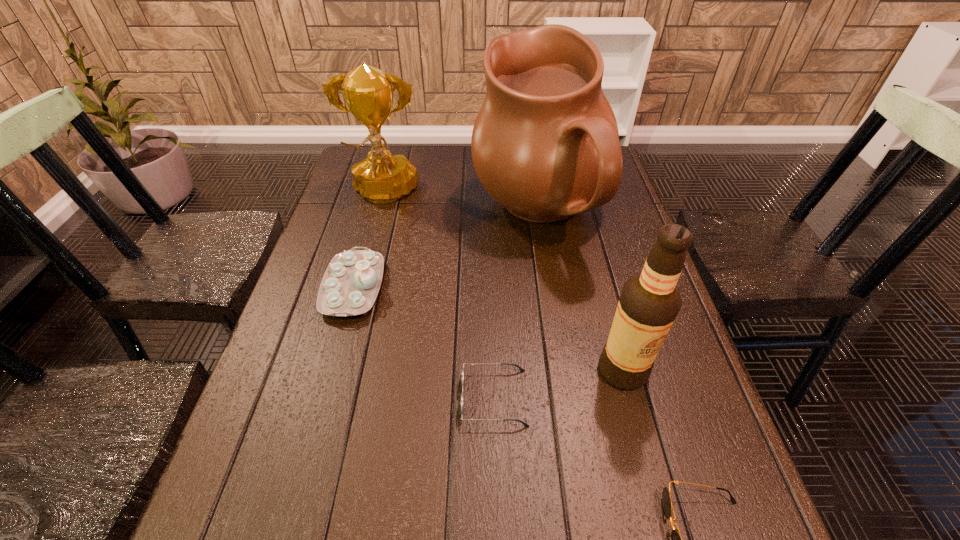
Identify the location of object located at the far left corner. (382, 177).

Identify the location of object that is positioned at the far right corner. (545, 145).

Identify the location of free space at the near edge of the desktop. (635, 537).

The width and height of the screenshot is (960, 540). In the image, there is a desktop. In order to click on vacant space at the left edge in this screenshot , I will do `click(276, 400)`.

The height and width of the screenshot is (540, 960). I want to click on free space at the right edge, so click(696, 441).

Identify the location of free space between the award and the farther sunglasses. (439, 296).

At what (x,y) coordinates should I click in order to perform the action: click on vacant region between the award and the chinaware. Please return your answer as a coordinate pair (x, y). Looking at the image, I should click on (369, 241).

Find the location of a particular element. The image size is (960, 540). blank region between the third shortest object and the alcohol is located at coordinates (489, 329).

What are the coordinates of `unoccupied area between the award and the alcohol` in the screenshot? It's located at (503, 282).

Find the location of a particular element. The height and width of the screenshot is (540, 960). free space between the award and the left sunglasses is located at coordinates (439, 296).